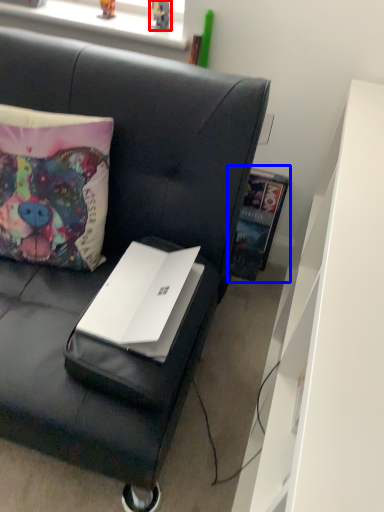
Question: Which object appears farthest to the camera in this image, toy (highlighted by a red box) or book (highlighted by a blue box)?

Choices:
 (A) toy
 (B) book

Answer: (B)